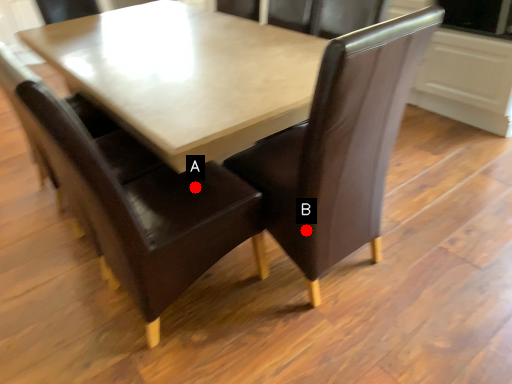
Question: Two points are circled on the image, labeled by A and B beside each circle. Among these points, which one is nearest to the camera?

Choices:
 (A) A is closer
 (B) B is closer

Answer: (B)